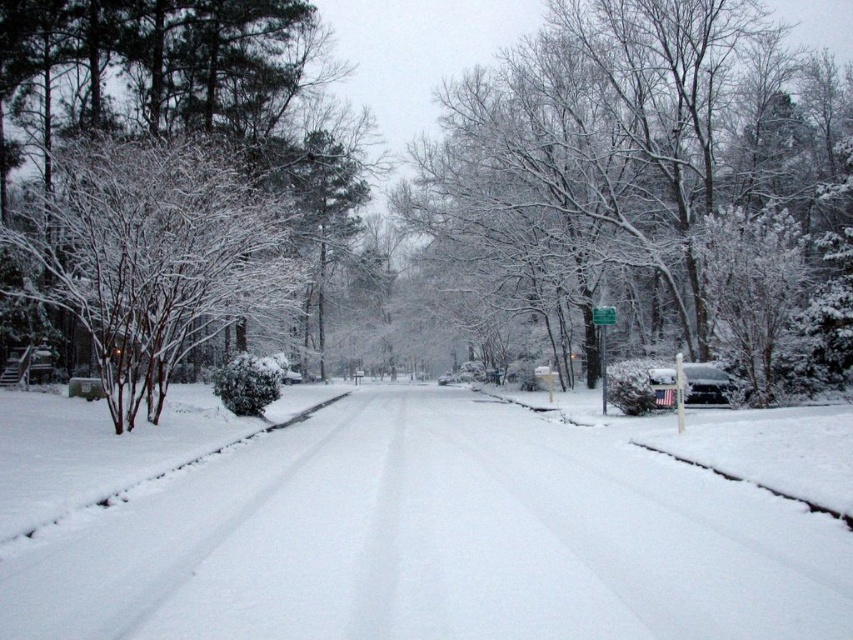
Is white snow-covered tree at left thinner than green plastic street sign at center?

Incorrect, white snow-covered tree at left's width is not less than green plastic street sign at center's.

Is white snow-covered tree at left above green plastic street sign at center?

Correct, white snow-covered tree at left is located above green plastic street sign at center.

Between point (235, 228) and point (608, 307), which one is positioned in front?

Point (235, 228) is in front.

Where is `white snow-covered tree at left`? white snow-covered tree at left is located at coordinates point(154,257).

Between sleek black sedan at center and green plastic street sign at center, which one appears on the right side from the viewer's perspective?

Positioned to the right is sleek black sedan at center.

Which is below, sleek black sedan at center or green plastic street sign at center?

sleek black sedan at center

Between point (670, 406) and point (601, 310), which one is positioned behind?

The point (601, 310) is more distant.

This screenshot has height=640, width=853. I want to click on sleek black sedan at center, so click(x=706, y=385).

Is snow-covered tree at center to the right of white snow-covered tree at left from the viewer's perspective?

Correct, you'll find snow-covered tree at center to the right of white snow-covered tree at left.

Is point (596, 109) closer to viewer compared to point (250, 282)?

No, it is behind (250, 282).

I want to click on snow-covered tree at center, so click(x=631, y=138).